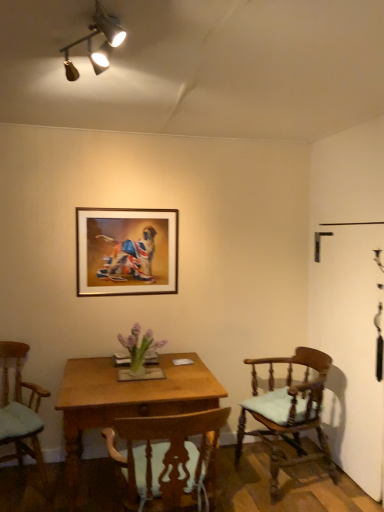
Question: Is wooden chair at center, which is counted as the 2th chair, starting from the left, spatially inside light brown wood chair at right, marked as the first chair in a right-to-left arrangement, or outside of it?

Choices:
 (A) inside
 (B) outside

Answer: (B)

Question: Is wooden chair at center, which appears as the second chair when viewed from the right, to the left or to the right of light brown wood chair at right, marked as the first chair in a right-to-left arrangement, in the image?

Choices:
 (A) left
 (B) right

Answer: (A)

Question: Which of these objects is positioned farthest from the gold-framed picture at upper center?

Choices:
 (A) wooden desk at center
 (B) light brown wood chair at right, which is the third chair in left-to-right order
 (C) wooden chair at center, which appears as the second chair when viewed from the right
 (D) light green fabric chair at lower left, the third chair positioned from the right

Answer: (C)

Question: Which of these objects is positioned farthest from the wooden chair at center, which is counted as the 2th chair, starting from the left?

Choices:
 (A) wooden desk at center
 (B) light green fabric chair at lower left, the third chair positioned from the right
 (C) light brown wood chair at right, which is the third chair in left-to-right order
 (D) gold-framed picture at upper center

Answer: (D)